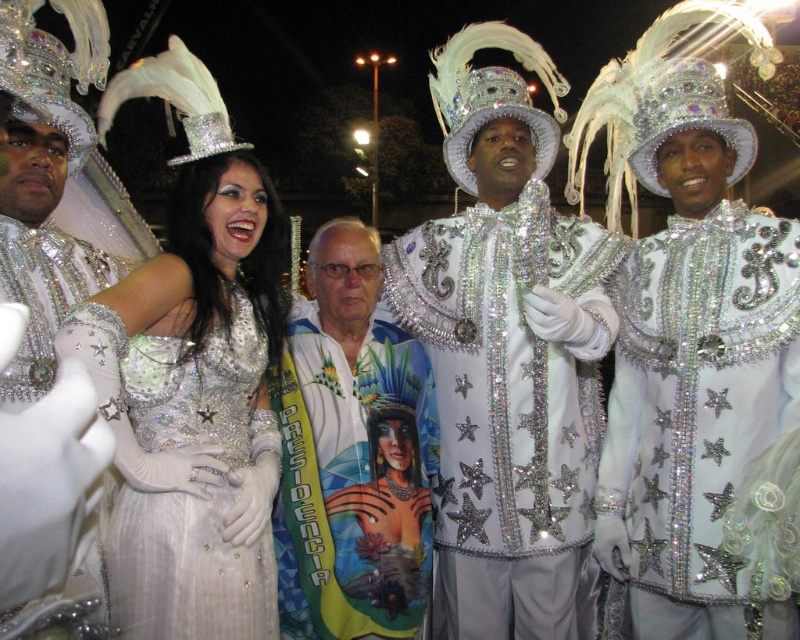
Does sparkly silver jacket at center appear over satin/sequined dress at center?

Indeed, sparkly silver jacket at center is positioned over satin/sequined dress at center.

Does sparkly silver jacket at center have a lesser height compared to satin/sequined dress at center?

No.

At what (x,y) coordinates should I click in order to perform the action: click on sparkly silver jacket at center. Please return your answer as a coordinate pair (x, y). Looking at the image, I should click on (508, 355).

Can you confirm if glittery silver jacket at center is wider than sparkly silver headdress at center?

Indeed, glittery silver jacket at center has a greater width compared to sparkly silver headdress at center.

Describe the element at coordinates (696, 416) in the screenshot. I see `glittery silver jacket at center` at that location.

Between point (609, 564) and point (528, 116), which one is positioned in front?

Point (609, 564) is in front.

You are a GUI agent. You are given a task and a screenshot of the screen. Output one action in this format:
    pyautogui.click(x=<x>, y=<y>)
    Task: Click on the glittery silver jacket at center
    Image resolution: width=800 pixels, height=640 pixels.
    Given the screenshot: What is the action you would take?
    pyautogui.click(x=696, y=416)

Does white fabric sash at center appear on the left side of satin/sequined dress at center?

Incorrect, white fabric sash at center is not on the left side of satin/sequined dress at center.

Which is more to the right, white fabric sash at center or satin/sequined dress at center?

white fabric sash at center is more to the right.

I want to click on white fabric sash at center, so click(352, 456).

This screenshot has width=800, height=640. I want to click on white fabric sash at center, so click(x=352, y=456).